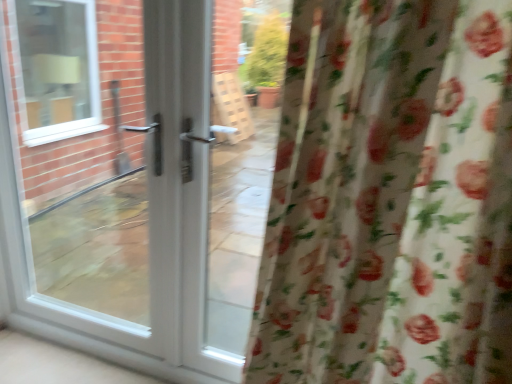
Find the location of a particular element. This screenshot has height=384, width=512. white glossy door at center is located at coordinates (111, 177).

This screenshot has width=512, height=384. What do you see at coordinates (111, 177) in the screenshot?
I see `white glossy door at center` at bounding box center [111, 177].

The height and width of the screenshot is (384, 512). What are the coordinates of `floral fabric curtain at right` in the screenshot? It's located at point(390,198).

What do you see at coordinates (390, 198) in the screenshot? The image size is (512, 384). I see `floral fabric curtain at right` at bounding box center [390, 198].

Measure the distance between point (372, 273) and camera.

Point (372, 273) is 34.49 inches away from camera.

Locate an element on the screen. The image size is (512, 384). white glossy door at center is located at coordinates (111, 177).

Is floral fabric curtain at right at the left side of white glossy door at center?

Incorrect, floral fabric curtain at right is not on the left side of white glossy door at center.

Considering the positions of objects floral fabric curtain at right and white glossy door at center in the image provided, who is behind, floral fabric curtain at right or white glossy door at center?

Positioned behind is white glossy door at center.

Is point (292, 207) more distant than point (232, 378)?

No.

From the image's perspective, is floral fabric curtain at right on top of white glossy door at center?

Incorrect, from the image's perspective, floral fabric curtain at right is lower than white glossy door at center.

From a real-world perspective, is floral fabric curtain at right beneath white glossy door at center?

No.

Is floral fabric curtain at right thinner than white glossy door at center?

In fact, floral fabric curtain at right might be wider than white glossy door at center.

Considering the sizes of objects floral fabric curtain at right and white glossy door at center in the image provided, who is shorter, floral fabric curtain at right or white glossy door at center?

With less height is floral fabric curtain at right.

Between floral fabric curtain at right and white glossy door at center, which one has smaller size?

floral fabric curtain at right.

Is floral fabric curtain at right positioned beyond the bounds of white glossy door at center?

Indeed, floral fabric curtain at right is completely outside white glossy door at center.

Is floral fabric curtain at right placed right next to white glossy door at center?

No, floral fabric curtain at right is not with white glossy door at center.

Is floral fabric curtain at right aimed at white glossy door at center?

No, floral fabric curtain at right is not aimed at white glossy door at center.

What's the angular difference between floral fabric curtain at right and white glossy door at center's facing directions?

The facing directions of floral fabric curtain at right and white glossy door at center are 0.859 degrees apart.

The image size is (512, 384). Identify the location of curtain lying below the white glossy door at center (from the image's perspective). (390, 198).

Which object is positioned more to the right, white glossy door at center or floral fabric curtain at right?

floral fabric curtain at right.

Considering the positions of objects white glossy door at center and floral fabric curtain at right in the image provided, who is in front, white glossy door at center or floral fabric curtain at right?

Positioned in front is floral fabric curtain at right.

Which point is more forward, (128, 172) or (458, 245)?

The point (458, 245) is closer.

From the image's perspective, is white glossy door at center under floral fabric curtain at right?

Actually, white glossy door at center appears above floral fabric curtain at right in the image.

From a real-world perspective, between white glossy door at center and floral fabric curtain at right, who is vertically lower?

white glossy door at center.

Can you confirm if white glossy door at center is wider than floral fabric curtain at right?

No.

Looking at this image, considering the sizes of objects white glossy door at center and floral fabric curtain at right in the image provided, who is taller, white glossy door at center or floral fabric curtain at right?

Standing taller between the two is white glossy door at center.

In terms of size, does white glossy door at center appear bigger or smaller than floral fabric curtain at right?

white glossy door at center is bigger than floral fabric curtain at right.

Is floral fabric curtain at right inside white glossy door at center?

No, floral fabric curtain at right is not inside white glossy door at center.

In the scene shown: Is white glossy door at center in contact with floral fabric curtain at right?

No, white glossy door at center is not touching floral fabric curtain at right.

Is white glossy door at center oriented away from floral fabric curtain at right?

No, white glossy door at center is not facing the opposite direction of floral fabric curtain at right.

From the picture: What's the angular difference between white glossy door at center and floral fabric curtain at right's facing directions?

white glossy door at center and floral fabric curtain at right are facing 0.859 degrees away from each other.

How distant is white glossy door at center from floral fabric curtain at right?

white glossy door at center and floral fabric curtain at right are 1.04 meters apart.

The height and width of the screenshot is (384, 512). There is a white glossy door at center. Identify the location of curtain above it (from a real-world perspective). (390, 198).

The width and height of the screenshot is (512, 384). Find the location of `curtain lying on the right of white glossy door at center`. curtain lying on the right of white glossy door at center is located at coordinates (390, 198).

Image resolution: width=512 pixels, height=384 pixels. Identify the location of door located behind the floral fabric curtain at right. (111, 177).